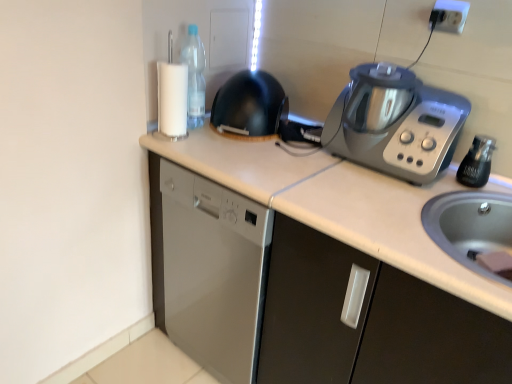
Question: From the image's perspective, would you say transparent plastic bottle at upper left, the 1th bottle from the back, is positioned over black glass bottle at right, the 2th bottle when ordered from back to front?

Choices:
 (A) yes
 (B) no

Answer: (A)

Question: Does transparent plastic bottle at upper left, the 1th bottle from the back, have a greater height compared to black glass bottle at right, which is the 1th bottle from bottom to top?

Choices:
 (A) yes
 (B) no

Answer: (A)

Question: Is transparent plastic bottle at upper left, which is the 1th bottle from top to bottom, closer to the viewer compared to black glass bottle at right, which is the first bottle from front to back?

Choices:
 (A) no
 (B) yes

Answer: (A)

Question: From a real-world perspective, is transparent plastic bottle at upper left, which appears as the 1th bottle when viewed from the left, over black glass bottle at right, which is counted as the 2th bottle, starting from the left?

Choices:
 (A) no
 (B) yes

Answer: (B)

Question: Is transparent plastic bottle at upper left, positioned as the 2th bottle in bottom-to-top order, smaller than black glass bottle at right, which is the 1th bottle from bottom to top?

Choices:
 (A) yes
 (B) no

Answer: (B)

Question: Can you confirm if transparent plastic bottle at upper left, which appears as the 1th bottle when viewed from the left, is wider than black glass bottle at right, the 2th bottle when ordered from back to front?

Choices:
 (A) no
 (B) yes

Answer: (B)

Question: Does black matte wok at center have a lesser height compared to white plastic electric outlet at upper right?

Choices:
 (A) yes
 (B) no

Answer: (B)

Question: Considering the relative sizes of black matte wok at center and white plastic electric outlet at upper right in the image provided, is black matte wok at center wider than white plastic electric outlet at upper right?

Choices:
 (A) no
 (B) yes

Answer: (B)

Question: Is black matte wok at center completely or partially outside of white plastic electric outlet at upper right?

Choices:
 (A) no
 (B) yes

Answer: (B)

Question: Can you see black matte wok at center touching white plastic electric outlet at upper right?

Choices:
 (A) yes
 (B) no

Answer: (B)

Question: Is black matte wok at center oriented away from white plastic electric outlet at upper right?

Choices:
 (A) no
 (B) yes

Answer: (A)

Question: From a real-world perspective, is black matte wok at center under white plastic electric outlet at upper right?

Choices:
 (A) yes
 (B) no

Answer: (A)

Question: From the image's perspective, would you say white plastic electric outlet at upper right is positioned over transparent plastic bottle at upper left, placed as the second bottle when sorted from right to left?

Choices:
 (A) no
 (B) yes

Answer: (B)